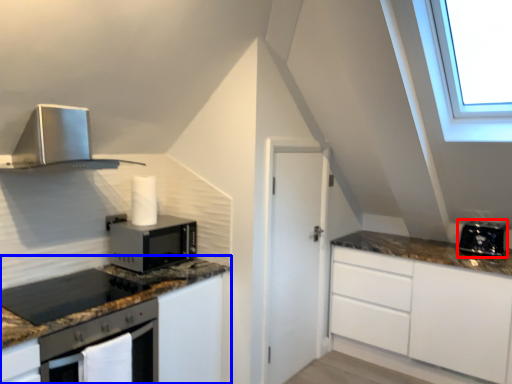
Question: Which point is further to the camera, toaster (highlighted by a red box) or cabinetry (highlighted by a blue box)?

Choices:
 (A) toaster
 (B) cabinetry

Answer: (A)